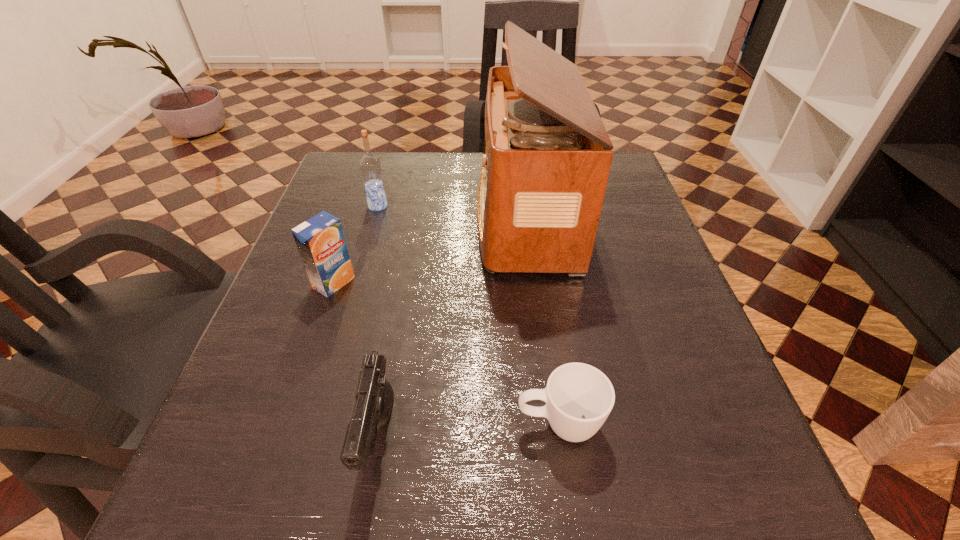
I want to click on free space between the tallest object and the orange_juice, so click(429, 249).

Locate an element on the screen. vacant region between the second shortest object and the radio receiver is located at coordinates pos(452,327).

Where is `empty space that is in between the vodka and the tallest object`? This screenshot has width=960, height=540. empty space that is in between the vodka and the tallest object is located at coordinates (451, 211).

Where is `free space between the third object from left to right and the orange_juice`? The image size is (960, 540). free space between the third object from left to right and the orange_juice is located at coordinates (356, 361).

Find the location of a particular element. This screenshot has width=960, height=540. vacant point located between the vodka and the orange_juice is located at coordinates (356, 245).

Identify the location of free space between the shortest object and the third object from left to right. The height and width of the screenshot is (540, 960). (469, 431).

In order to click on object that is the second closest one to the cup in this screenshot , I will do `click(547, 155)`.

Identify which object is located as the fourth nearest to the vodka. Please provide its 2D coordinates. Your answer should be formatted as a tuple, i.e. [(x, y)], where the tuple contains the x and y coordinates of a point satisfying the conditions above.

[(579, 397)]

Locate an element on the screen. free point that satisfies the following two spatial constraints: 1. with the handle on the side of the shortest object; 2. at the barrel of the fourth tallest object is located at coordinates (561, 438).